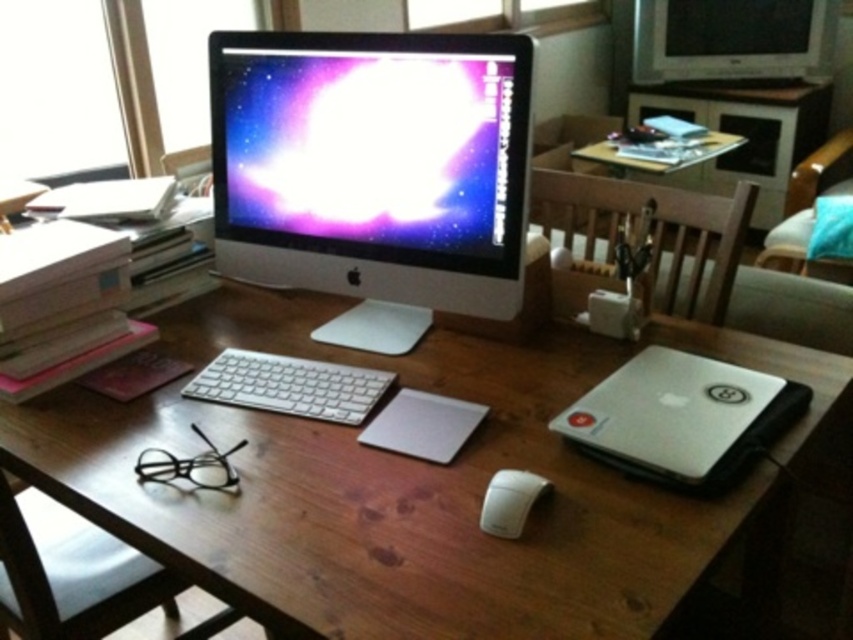
Does wooden chair at center have a greater height compared to silver metallic television at upper right?

Correct, wooden chair at center is much taller as silver metallic television at upper right.

Is wooden chair at center smaller than silver metallic television at upper right?

Incorrect, wooden chair at center is not smaller in size than silver metallic television at upper right.

Locate an element on the screen. This screenshot has height=640, width=853. wooden chair at center is located at coordinates (653, 234).

Who is more distant from viewer, (349, 148) or (753, 29)?

Positioned behind is point (753, 29).

Based on the photo, who is positioned more to the right, white glossy computer monitor at center or silver metallic television at upper right?

silver metallic television at upper right

Describe the element at coordinates (375, 168) in the screenshot. The width and height of the screenshot is (853, 640). I see `white glossy computer monitor at center` at that location.

Identify the location of white glossy computer monitor at center. (375, 168).

Does white plastic keyboard at center appear on the right side of white matte mouse at lower right?

No, white plastic keyboard at center is not to the right of white matte mouse at lower right.

Does point (292, 410) come farther from viewer compared to point (514, 497)?

Yes.

Identify the location of white plastic keyboard at center. (289, 385).